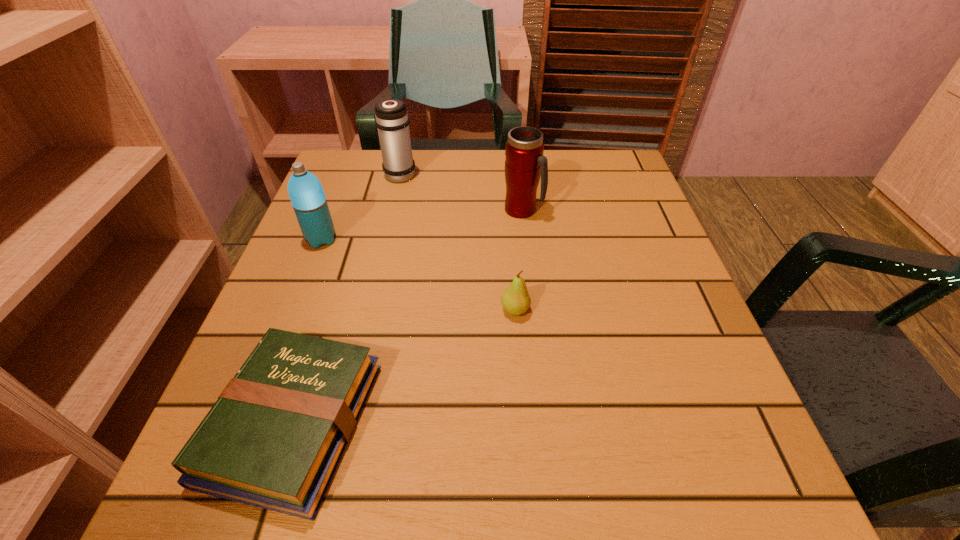
In order to click on free region at the left edge of the desktop in this screenshot , I will do `click(300, 242)`.

The height and width of the screenshot is (540, 960). In the image, there is a desktop. Identify the location of free space at the right edge. (701, 361).

This screenshot has height=540, width=960. I want to click on vacant area at the far left corner of the desktop, so click(336, 202).

Identify the location of vacant area at the far right corner. This screenshot has width=960, height=540. (580, 187).

This screenshot has width=960, height=540. I want to click on free space between the leftmost thermos bottle and the fourth tallest object, so click(419, 274).

This screenshot has height=540, width=960. What are the coordinates of `free space between the farthest object and the leftmost thermos bottle` in the screenshot? It's located at (361, 206).

Locate an element on the screen. This screenshot has height=540, width=960. unoccupied position between the farthest object and the shortest object is located at coordinates (347, 298).

This screenshot has width=960, height=540. Find the location of `free space between the rightmost thermos bottle and the nearest object`. free space between the rightmost thermos bottle and the nearest object is located at coordinates (408, 316).

Locate an element on the screen. vacant area that lies between the second thermos bottle from left to right and the fourth nearest object is located at coordinates (462, 192).

Locate an element on the screen. vacant space that is in between the rightmost thermos bottle and the pear is located at coordinates (518, 260).